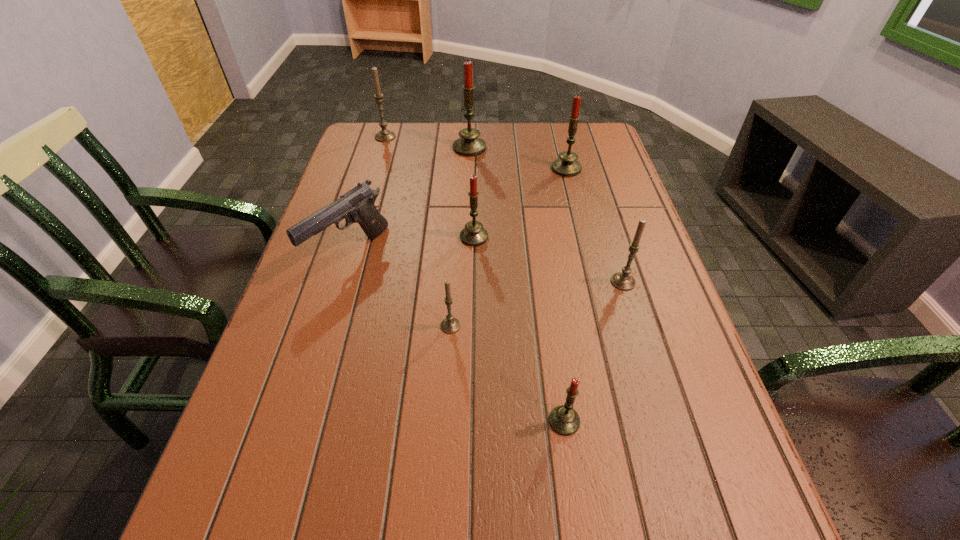
Image resolution: width=960 pixels, height=540 pixels. In order to click on vacant space situated 0.180m at the muzzle of the black gun in this screenshot , I will do `click(320, 353)`.

At what (x,y) coordinates should I click in order to perform the action: click on vacant area situated on the back of the smallest red candle. Please return your answer as a coordinate pair (x, y). Image resolution: width=960 pixels, height=540 pixels. Looking at the image, I should click on (556, 359).

This screenshot has width=960, height=540. I want to click on free location located 0.170m on the front of the sixth farthest candle, so click(x=445, y=412).

This screenshot has width=960, height=540. Find the location of `candle that is at the left edge`. candle that is at the left edge is located at coordinates (384, 135).

Find the location of a particular element. This screenshot has height=540, width=960. gun positioned at the left edge is located at coordinates pyautogui.click(x=357, y=205).

Find the location of a particular element. This screenshot has height=540, width=960. object located at the far left corner is located at coordinates 384,135.

This screenshot has height=540, width=960. What are the coordinates of `blank space at the far edge of the desktop` in the screenshot? It's located at (494, 127).

Image resolution: width=960 pixels, height=540 pixels. In the image, there is a desktop. In order to click on vacant space at the left edge in this screenshot , I will do `click(394, 165)`.

Where is `vacant region at the right edge of the desktop`? vacant region at the right edge of the desktop is located at coordinates (614, 217).

Locate an element on the screen. vacant space at the far left corner of the desktop is located at coordinates (395, 156).